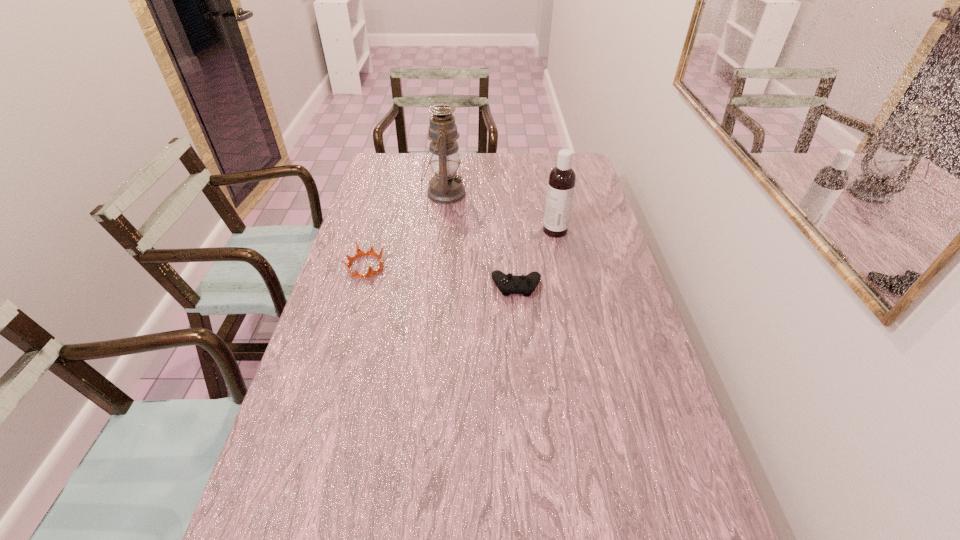
Locate an element on the screen. The width and height of the screenshot is (960, 540). vacant area between the shortest object and the crown is located at coordinates (441, 276).

Where is `object that stands as the third closest to the shortest object`? object that stands as the third closest to the shortest object is located at coordinates (445, 187).

You are a GUI agent. You are given a task and a screenshot of the screen. Output one action in this format:
    pyautogui.click(x=<x>, y=<y>)
    Task: Click on the object that is the second nearest to the oil lamp
    The height and width of the screenshot is (540, 960).
    Given the screenshot: What is the action you would take?
    pyautogui.click(x=561, y=183)

Locate an element on the screen. This screenshot has width=960, height=540. vacant space that satisfies the following two spatial constraints: 1. on the front side of the second shortest object; 2. on the right side of the second object from right to left is located at coordinates (360, 286).

This screenshot has height=540, width=960. What are the coordinates of `vacant region that satisfies the following two spatial constraints: 1. on the front side of the second object from right to left; 2. on the right side of the crown` in the screenshot? It's located at (360, 286).